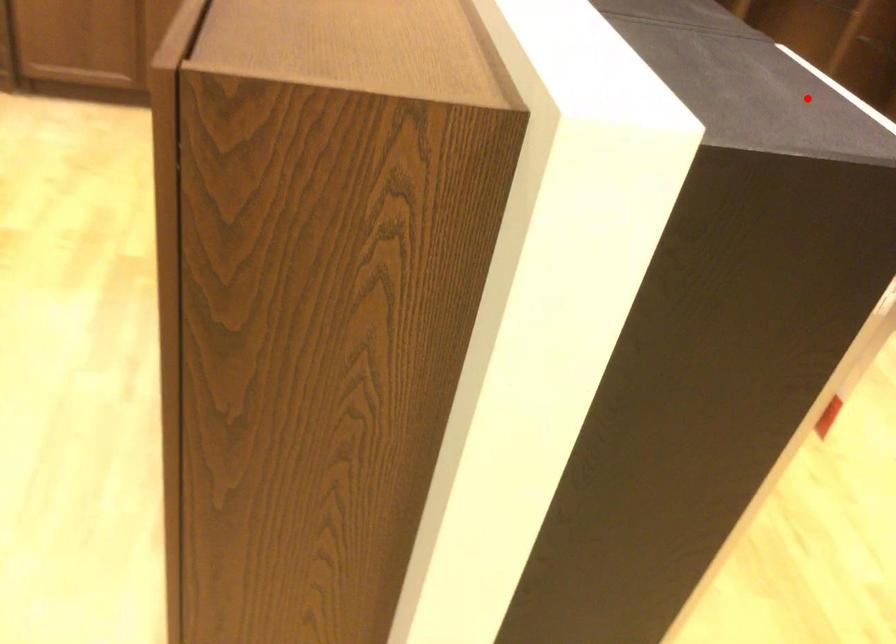
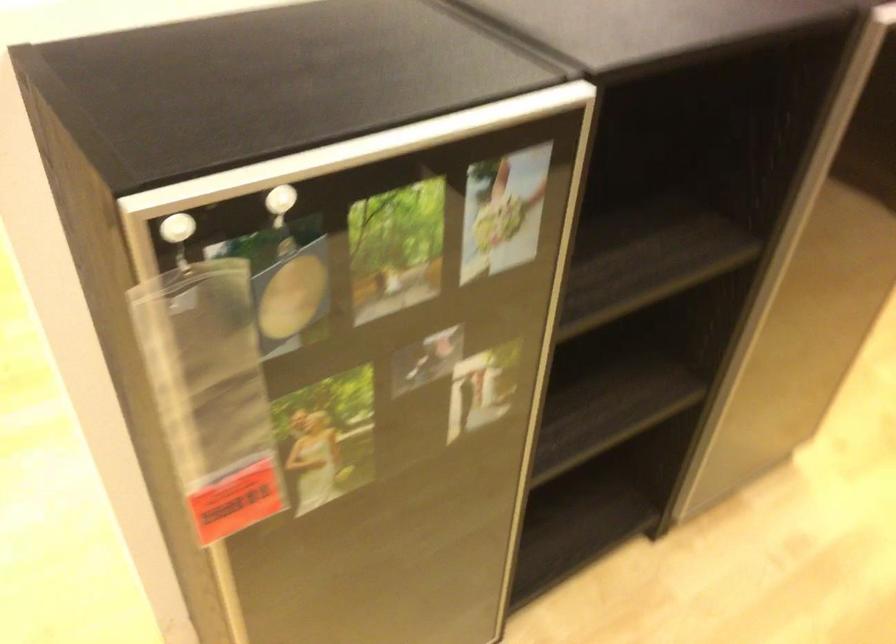
Question: I am providing you with two images of the same scene from different viewpoints. In image1, a red point is highlighted. Considering the same 3D point in image2, which of the following is correct?

Choices:
 (A) It is closer
 (B) It is farther

Answer: (A)